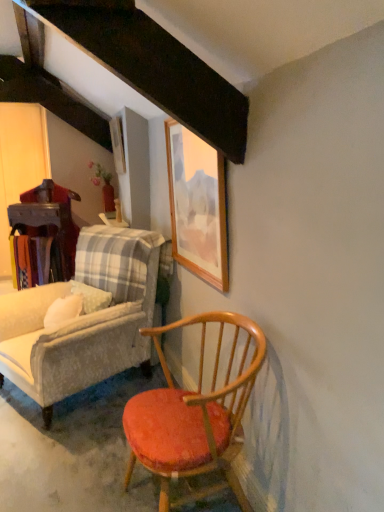
Question: Based on their sizes in the image, would you say wooden chair with orange cushion at lower right, arranged as the first chair when viewed from the right, is bigger or smaller than wooden table at left?

Choices:
 (A) small
 (B) big

Answer: (B)

Question: Visually, is wooden chair with orange cushion at lower right, the second chair positioned from the left, positioned to the left or to the right of wooden table at left?

Choices:
 (A) right
 (B) left

Answer: (A)

Question: Which object is positioned farthest from the wooden chair with orange cushion at lower right, the second chair positioned from the left?

Choices:
 (A) wooden picture frame at upper center, which appears as the 2th picture frame when viewed from the right
 (B) wooden table at left
 (C) wooden picture frame at upper center, which is the 1th picture frame in bottom-to-top order
 (D) wooden chair with cushion at lower left, the second chair viewed from the right

Answer: (A)

Question: Which object is the farthest from the wooden picture frame at upper center, the first picture frame positioned from the front?

Choices:
 (A) wooden table at left
 (B) wooden chair with cushion at lower left, the second chair viewed from the right
 (C) wooden picture frame at upper center, which appears as the 2th picture frame when viewed from the right
 (D) wooden chair with orange cushion at lower right, the second chair positioned from the left

Answer: (A)